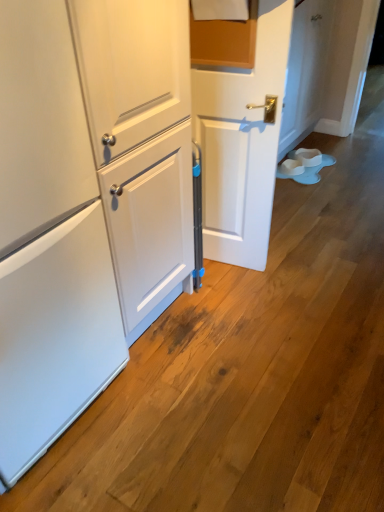
The width and height of the screenshot is (384, 512). Find the location of `vacant space to the right of white matte door at center`. vacant space to the right of white matte door at center is located at coordinates (294, 260).